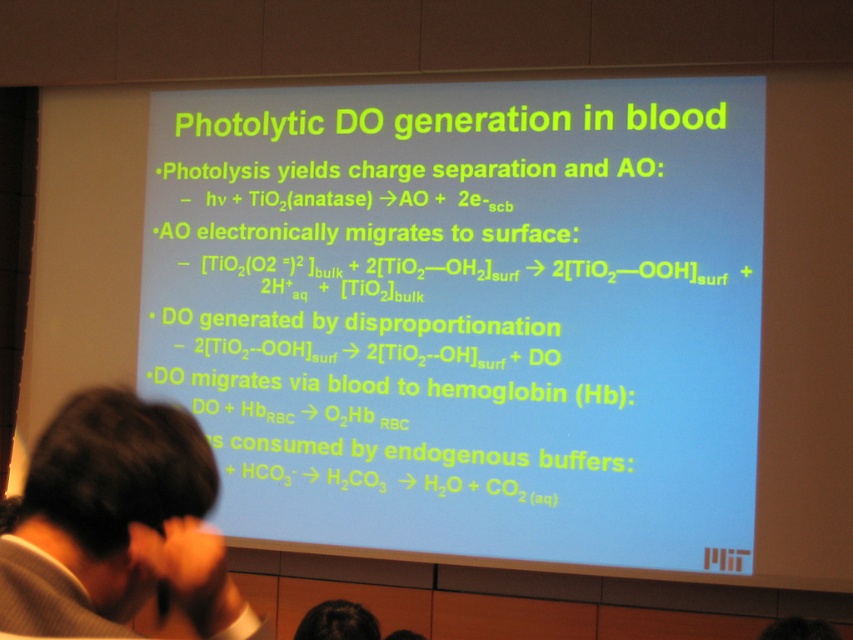
You are a student attending a lecture and see the slide displayed. The professor asks you to locate the main title of the slide. Where is the white text on blue background at center located on the slide?

The white text on blue background at center is located at point [467,312] on the slide.

You are a student sitting in the front row of the lecture hall. You notice the white text on blue background at center and the dark hair at lower left in your view. Which object is positioned more to the right side of your field of view?

The white text on blue background at center is positioned more to the right side of your field of view compared to the dark hair at lower left.